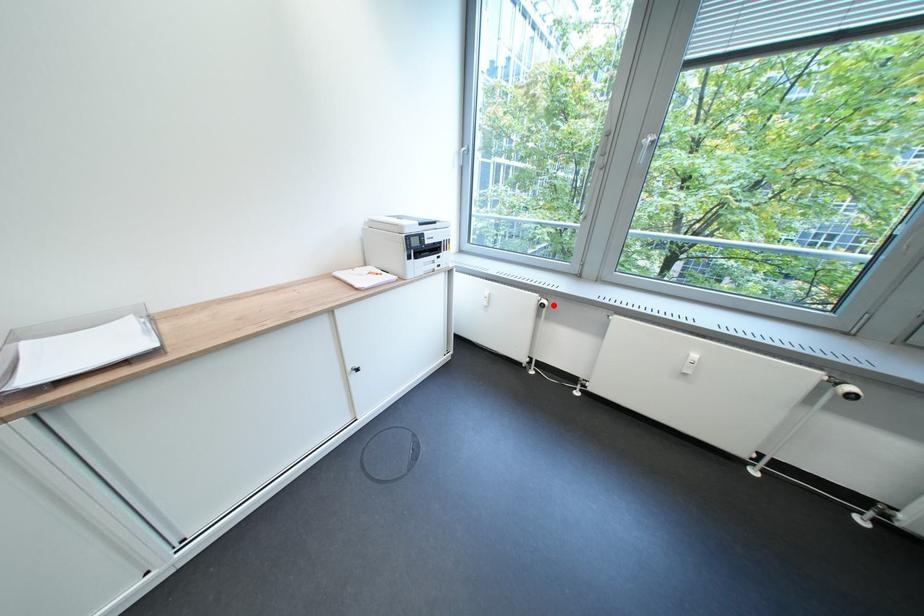
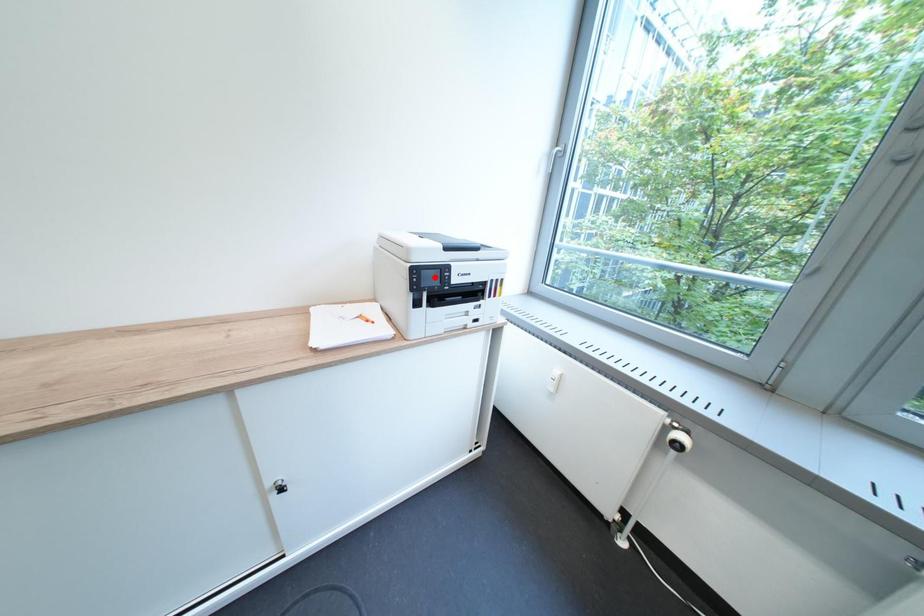
I am providing you with two images of the same scene from different viewpoints. A red point is marked on the first image and another point is marked on the second image. Are the points marked in image1 and image2 representing the same 3D position?

No